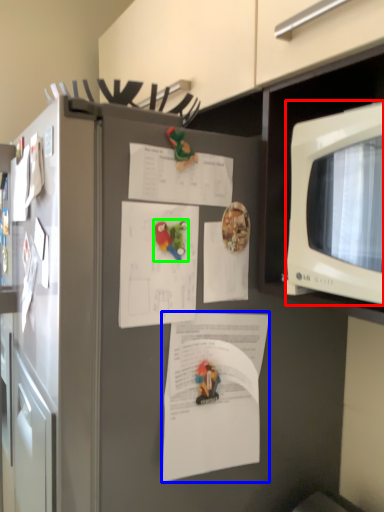
Question: Considering the real-world distances, which object is farthest from microwave oven (highlighted by a red box)? document (highlighted by a blue box) or toy (highlighted by a green box)?

Choices:
 (A) document
 (B) toy

Answer: (A)